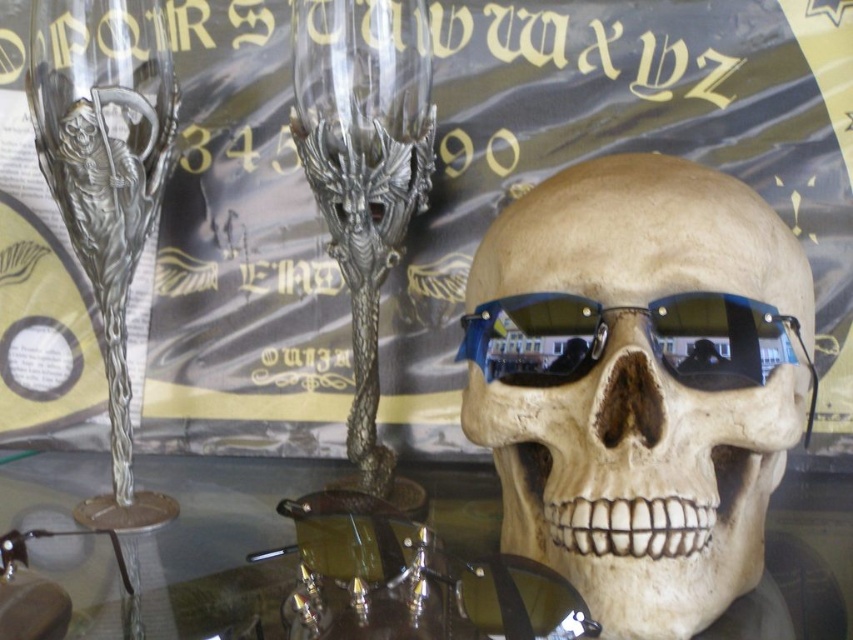
Question: Is transparent glass table at center below silver metallic wine glass at left?

Choices:
 (A) yes
 (B) no

Answer: (A)

Question: Among these objects, which one is nearest to the camera?

Choices:
 (A) transparent glass table at center
 (B) matte plastic skull at center
 (C) metallic silver poster at center
 (D) blue reflective plastic goggles at center

Answer: (A)

Question: Can you confirm if silver metallic wine glass at left is bigger than blue reflective plastic goggles at center?

Choices:
 (A) yes
 (B) no

Answer: (A)

Question: Can you confirm if matte plastic skull at center is positioned to the right of blue reflective plastic goggles at center?

Choices:
 (A) yes
 (B) no

Answer: (A)

Question: Which point appears closest to the camera in this image?

Choices:
 (A) (527, 296)
 (B) (457, 540)

Answer: (A)

Question: Which point is closer to the camera?

Choices:
 (A) matte plastic skull at center
 (B) metallic silver wine glass at center
 (C) blue reflective plastic goggles at center
 (D) silver metallic wine glass at left

Answer: (A)